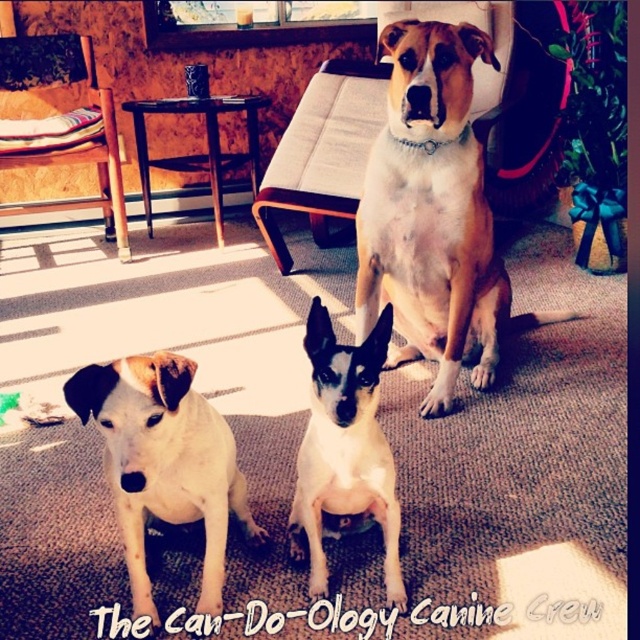
You are a visitor entering the room and want to greet the white fur dog at lower left first. Which direction should you move relative to the brushed wood chair at left?

To reach the white fur dog at lower left, you should move to the right of the brushed wood chair at left since the white fur dog at lower left is positioned to the right of it.

You are a photographer setting up a tripod at point (x=164, y=461). You need to capture a photo of the white fur dog at lower left without it being blocked by any other objects in the scene. Is there any obstruction between the tripod and the dog?

The white fur dog at lower left is located at point (x=164, y=461), so placing the tripod at that exact point would mean the dog is right where the tripod is. Therefore, the tripod itself would block the view of the dog, making it impossible to capture the dog in the photo without moving the tripod.

You are a dog owner who wants to place a water bowl between the light brown fur at center and the brushed wood chair at left. The bowl requires 2 feet of space to be placed comfortably. Is there enough space between them?

The light brown fur at center is 6.12 feet away from the brushed wood chair at left, so yes, there is enough space to place the water bowl between them since the distance is greater than the required 2 feet.